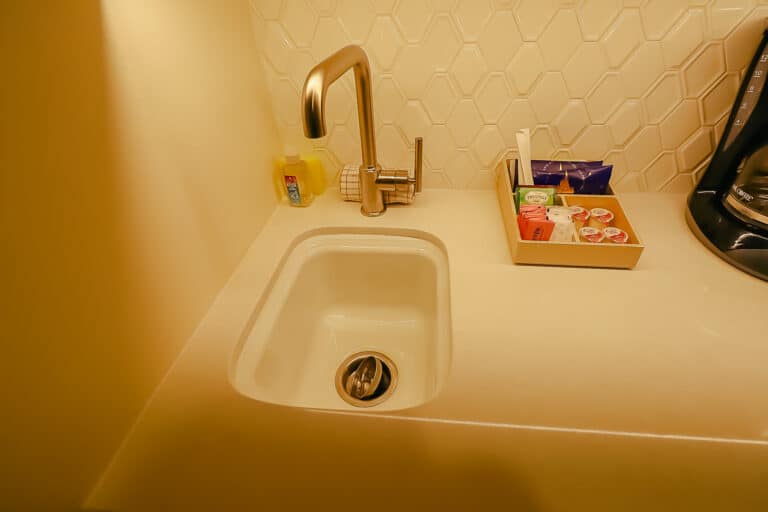
Where is `decorative tile pattern`? The image size is (768, 512). decorative tile pattern is located at coordinates (471, 62).